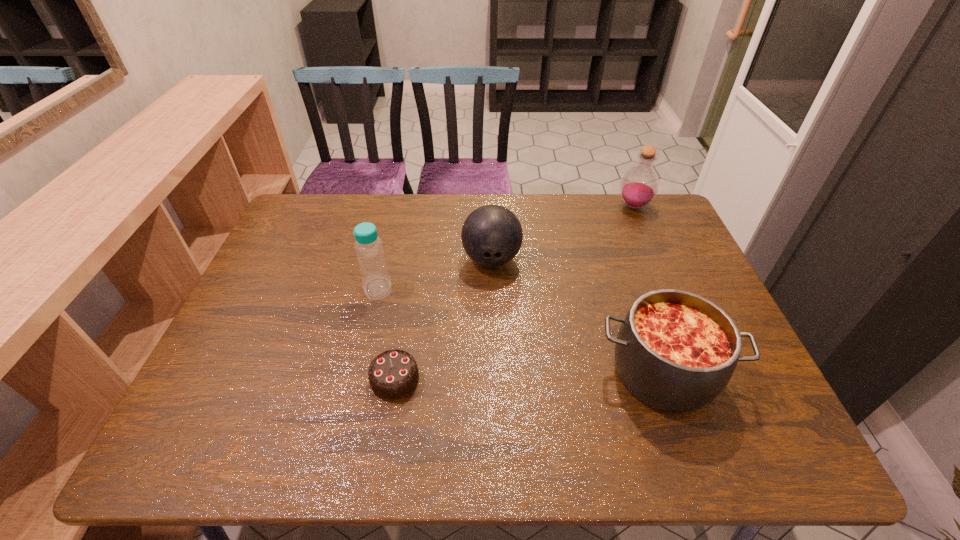
Image resolution: width=960 pixels, height=540 pixels. Identify the location of blank region between the left bottle and the third object from left to right. (435, 274).

Where is `free space between the casserole and the nearer bottle`? free space between the casserole and the nearer bottle is located at coordinates (520, 330).

Identify the location of vacant area that lies between the left bottle and the chocolate cake. This screenshot has height=540, width=960. (387, 334).

The image size is (960, 540). Identify the location of free spot between the casserole and the bowling ball. (577, 316).

This screenshot has height=540, width=960. In order to click on free spot between the casserole and the nearer bottle in this screenshot , I will do `click(520, 330)`.

You are a GUI agent. You are given a task and a screenshot of the screen. Output one action in this format:
    pyautogui.click(x=<x>, y=<y>)
    Task: Click on the free spot between the chocolate cake and the bowling ball
    
    Given the screenshot: What is the action you would take?
    pyautogui.click(x=444, y=320)

Where is `free space between the farther bottle and the casserole`? The image size is (960, 540). free space between the farther bottle and the casserole is located at coordinates (648, 289).

You are a GUI agent. You are given a task and a screenshot of the screen. Output one action in this format:
    pyautogui.click(x=<x>, y=<y>)
    Task: Click on the unoccupied area between the casserole and the bowling ball
    Image resolution: width=960 pixels, height=540 pixels.
    Given the screenshot: What is the action you would take?
    pyautogui.click(x=577, y=316)

At what (x,y) coordinates should I click in order to perform the action: click on free space between the right bottle and the shortest object. Please return your answer as a coordinate pair (x, y). This screenshot has height=540, width=960. Looking at the image, I should click on (515, 293).

Identify the location of empty space between the bowling ball and the chocolate cake. (x=444, y=320).